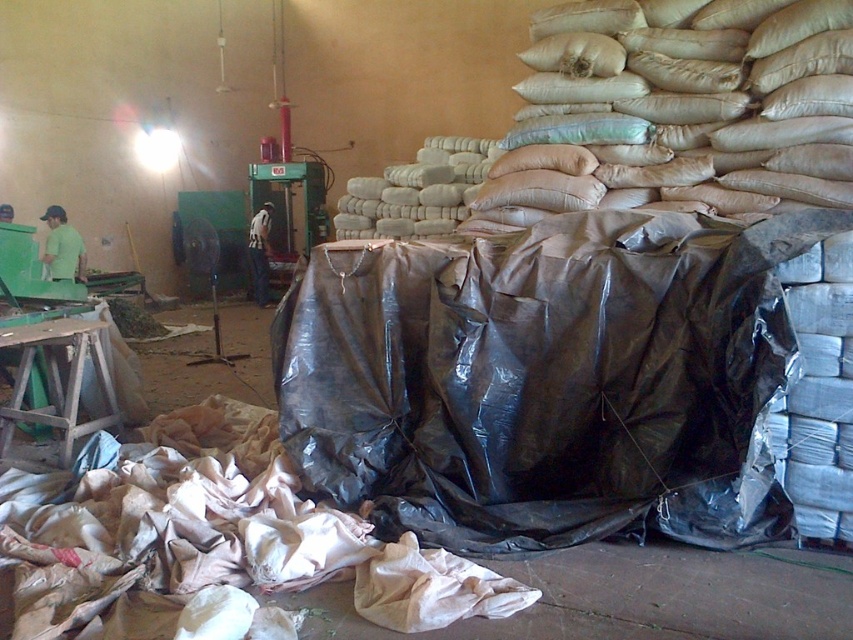
Identify the location of green matte shirt at left. (62, 248).

Is point (80, 266) positioned behind point (264, 253)?

No, (80, 266) is in front of (264, 253).

Where is `green matte shirt at left`? This screenshot has height=640, width=853. green matte shirt at left is located at coordinates (62, 248).

Where is `green matte shirt at left`? The width and height of the screenshot is (853, 640). green matte shirt at left is located at coordinates (62, 248).

Between beige fabric sack at lower left and green matte shirt at left, which one is positioned lower?

beige fabric sack at lower left

Which is above, beige fabric sack at lower left or green matte shirt at left?

Positioned higher is green matte shirt at left.

Is point (207, 608) farther from viewer compared to point (62, 273)?

That is False.

What are the coordinates of `beige fabric sack at lower left` in the screenshot? It's located at (212, 541).

Consider the image. Which is more to the right, beige fabric sack at lower left or white striped shirt at center?

beige fabric sack at lower left

Is point (26, 602) positioned behind point (247, 244)?

No, (26, 602) is closer to viewer.

Is point (57, 506) farther from camera compared to point (265, 241)?

No, it is in front of (265, 241).

You are a GUI agent. You are given a task and a screenshot of the screen. Output one action in this format:
    pyautogui.click(x=<x>, y=<y>)
    Task: Click on the beige fabric sack at lower left
    This screenshot has height=640, width=853.
    Given the screenshot: What is the action you would take?
    pyautogui.click(x=212, y=541)